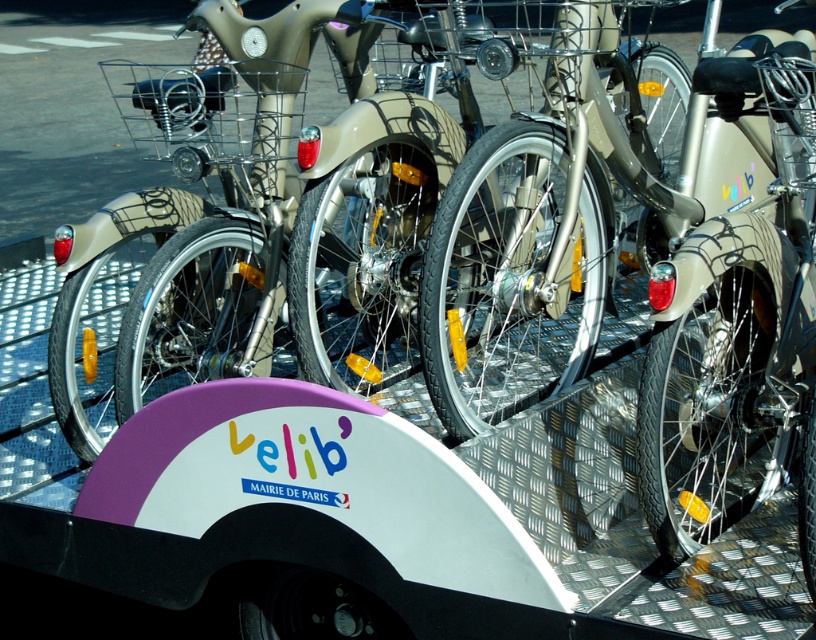
Question: Which object appears farthest from the camera in this image?

Choices:
 (A) matte beige bicycle at center
 (B) matte silver bicycle at center

Answer: (A)

Question: Is matte beige bicycle at center to the left of matte silver bicycle at center from the viewer's perspective?

Choices:
 (A) yes
 (B) no

Answer: (A)

Question: Can you confirm if matte beige bicycle at center is wider than matte silver bicycle at center?

Choices:
 (A) no
 (B) yes

Answer: (B)

Question: Which object is farther from the camera taking this photo?

Choices:
 (A) matte silver bicycle at center
 (B) matte beige bicycle at center

Answer: (B)

Question: Among these points, which one is farthest from the camera?

Choices:
 (A) (673, 522)
 (B) (697, 285)

Answer: (A)

Question: Where is matte beige bicycle at center located in relation to matte silver bicycle at center in the image?

Choices:
 (A) left
 (B) right

Answer: (A)